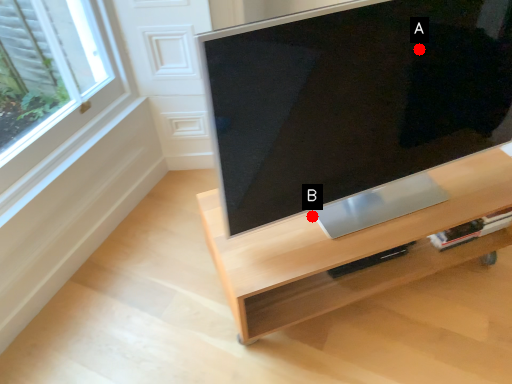
Question: Two points are circled on the image, labeled by A and B beside each circle. Which point is closer to the camera?

Choices:
 (A) A is closer
 (B) B is closer

Answer: (A)